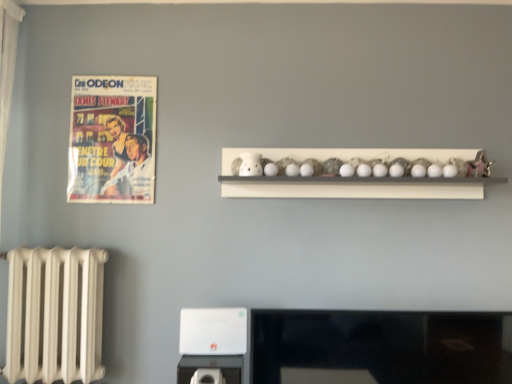
The width and height of the screenshot is (512, 384). What do you see at coordinates (112, 140) in the screenshot? I see `matte paper poster at upper left` at bounding box center [112, 140].

The width and height of the screenshot is (512, 384). Find the location of `white plastic appliance at lower center`. white plastic appliance at lower center is located at coordinates (211, 367).

From the image's perspective, which one is positioned lower, white matte shelf at upper center or matte paper poster at upper left?

white matte shelf at upper center, from the image's perspective.

Is white matte shelf at upper center at the left side of matte paper poster at upper left?

In fact, white matte shelf at upper center is to the right of matte paper poster at upper left.

Between point (470, 166) and point (99, 167), which one is positioned in front?

Positioned in front is point (470, 166).

From the image's perspective, relative to white plastic appliance at lower center, is matte paper poster at upper left above or below?

matte paper poster at upper left is above white plastic appliance at lower center.

What's the angular difference between matte paper poster at upper left and white plastic appliance at lower center's facing directions?

0.438 degrees.

Locate an element on the screen. This screenshot has height=384, width=512. comic book that is above the white plastic appliance at lower center (from a real-world perspective) is located at coordinates (112, 140).

Is matte paper poster at upper left placed right next to white plastic appliance at lower center?

No, matte paper poster at upper left is not in contact with white plastic appliance at lower center.

Is white matte shelf at upper center facing towards white plastic appliance at lower center?

No, white matte shelf at upper center is not facing towards white plastic appliance at lower center.

Is white matte shelf at upper center surrounding white plastic appliance at lower center?

No, white matte shelf at upper center does not contain white plastic appliance at lower center.

Which point is more forward, (401, 189) or (222, 371)?

The point (222, 371) is closer.

How far apart are white matte shelf at upper center and white plastic appliance at lower center?

88.66 centimeters.

Does white plastic appliance at lower center touch matte paper poster at upper left?

There is a gap between white plastic appliance at lower center and matte paper poster at upper left.

Measure the distance between white plastic appliance at lower center and matte paper poster at upper left.

white plastic appliance at lower center and matte paper poster at upper left are 38.93 inches apart from each other.

Considering the relative positions of white plastic appliance at lower center and matte paper poster at upper left in the image provided, is white plastic appliance at lower center behind matte paper poster at upper left?

That is False.

Looking at this image, is matte paper poster at upper left behind white matte shelf at upper center?

Yes.

From a real-world perspective, is matte paper poster at upper left below white matte shelf at upper center?

Incorrect, from a real-world perspective, matte paper poster at upper left is higher than white matte shelf at upper center.

Is matte paper poster at upper left bigger than white matte shelf at upper center?

Incorrect, matte paper poster at upper left is not larger than white matte shelf at upper center.

How distant is matte paper poster at upper left from white matte shelf at upper center?

matte paper poster at upper left and white matte shelf at upper center are 66.29 centimeters apart from each other.

Are white plastic appliance at lower center and white matte shelf at upper center located far from each other?

No, white plastic appliance at lower center is in close proximity to white matte shelf at upper center.

Locate an element on the screen. appliance located in front of the white matte shelf at upper center is located at coordinates (211, 367).

From the image's perspective, which is below, white plastic appliance at lower center or white matte shelf at upper center?

white plastic appliance at lower center is shown below in the image.

Is the position of white plastic appliance at lower center less distant than that of white matte shelf at upper center?

Yes, it is in front of white matte shelf at upper center.

Identify the location of comic book on the left of white matte shelf at upper center. (112, 140).

Locate an element on the screen. This screenshot has width=512, height=384. appliance located on the right of matte paper poster at upper left is located at coordinates (211, 367).

Consider the image. Based on their spatial positions, is white plastic appliance at lower center or matte paper poster at upper left further from white matte shelf at upper center?

Among the two, white plastic appliance at lower center is located further to white matte shelf at upper center.

Estimate the real-world distances between objects in this image. Which object is closer to white plastic appliance at lower center, matte paper poster at upper left or white matte shelf at upper center?

Based on the image, white matte shelf at upper center appears to be nearer to white plastic appliance at lower center.

Looking at the image, which one is located further to white plastic appliance at lower center, white matte shelf at upper center or matte paper poster at upper left?

The object further to white plastic appliance at lower center is matte paper poster at upper left.

Based on their spatial positions, is matte paper poster at upper left or white plastic appliance at lower center further from white matte shelf at upper center?

white plastic appliance at lower center is further to white matte shelf at upper center.

Based on their spatial positions, is white matte shelf at upper center or white plastic appliance at lower center closer to matte paper poster at upper left?

white matte shelf at upper center is positioned closer to the anchor matte paper poster at upper left.

From the image, which object appears to be nearer to matte paper poster at upper left, white plastic appliance at lower center or white matte shelf at upper center?

Based on the image, white matte shelf at upper center appears to be nearer to matte paper poster at upper left.

I want to click on appliance located between matte paper poster at upper left and white matte shelf at upper center in the left-right direction, so click(211, 367).